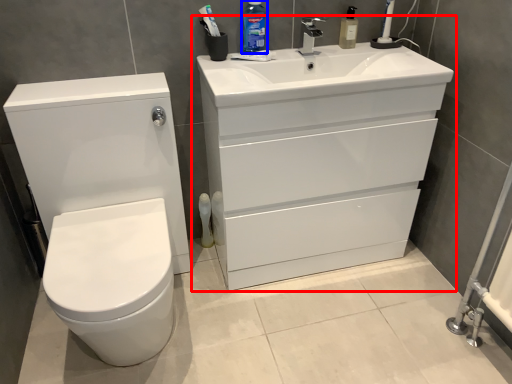
Question: Which point is further to the camera, bathroom cabinet (highlighted by a red box) or cleaning product (highlighted by a blue box)?

Choices:
 (A) bathroom cabinet
 (B) cleaning product

Answer: (B)